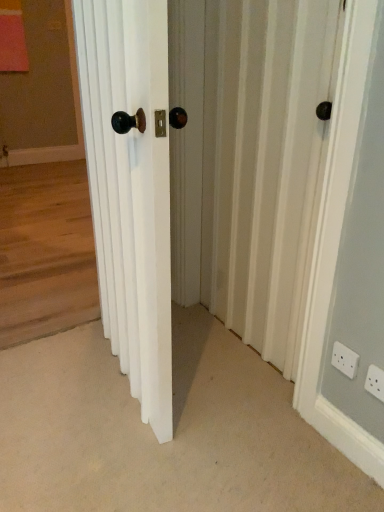
Question: Considering their positions, is white wooden door at center located in front of or behind white textured screen door at center?

Choices:
 (A) front
 (B) behind

Answer: (A)

Question: From their relative heights in the image, would you say white wooden door at center is taller or shorter than white textured screen door at center?

Choices:
 (A) tall
 (B) short

Answer: (B)

Question: Estimate the real-world distances between objects in this image. Which object is closer to the white plastic electric outlet at lower right, positioned as the 1th electric outlet in right-to-left order?

Choices:
 (A) white textured screen door at center
 (B) white wooden door at center
 (C) wooden floor at left
 (D) white plastic electric outlet at lower right, the first electric outlet from the back

Answer: (D)

Question: Based on their relative distances, which object is nearer to the white textured screen door at center?

Choices:
 (A) white wooden door at center
 (B) white plastic electric outlet at lower right, the first electric outlet from the back
 (C) wooden floor at left
 (D) white plastic electric outlet at lower right, the second electric outlet positioned from the left

Answer: (A)